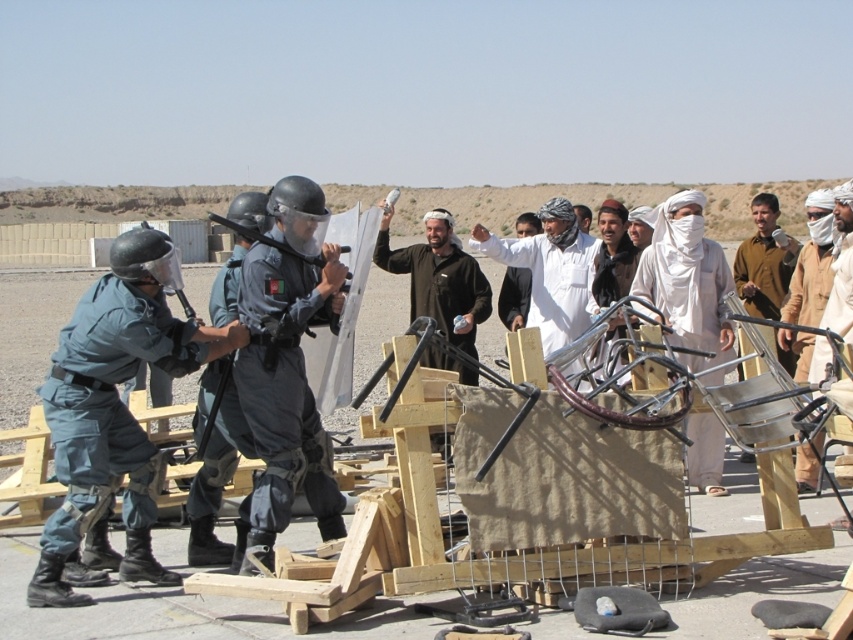
Does wooden frame at center lie in front of brown fabric turban at center?

Yes.

Who is more forward, [434,540] or [747,250]?

Positioned in front is point [434,540].

Is point (415, 589) in front of point (772, 272)?

Yes.

Image resolution: width=853 pixels, height=640 pixels. Find the location of `wooden frame at center`. wooden frame at center is located at coordinates (717, 540).

Based on the photo, does wooden frame at center have a larger size compared to white cotton turban at center?

Indeed, wooden frame at center has a larger size compared to white cotton turban at center.

Where is `wooden frame at center`? wooden frame at center is located at coordinates (717, 540).

Who is lower down, light brown fabric at center or brown fabric turban at center?

brown fabric turban at center is lower down.

Consider the image. Who is more forward, (589, 276) or (780, 248)?

→ Point (589, 276)

Between point (560, 253) and point (779, 246), which one is positioned in front?

Positioned in front is point (560, 253).

The width and height of the screenshot is (853, 640). What are the coordinates of `light brown fabric at center` in the screenshot? It's located at (550, 272).